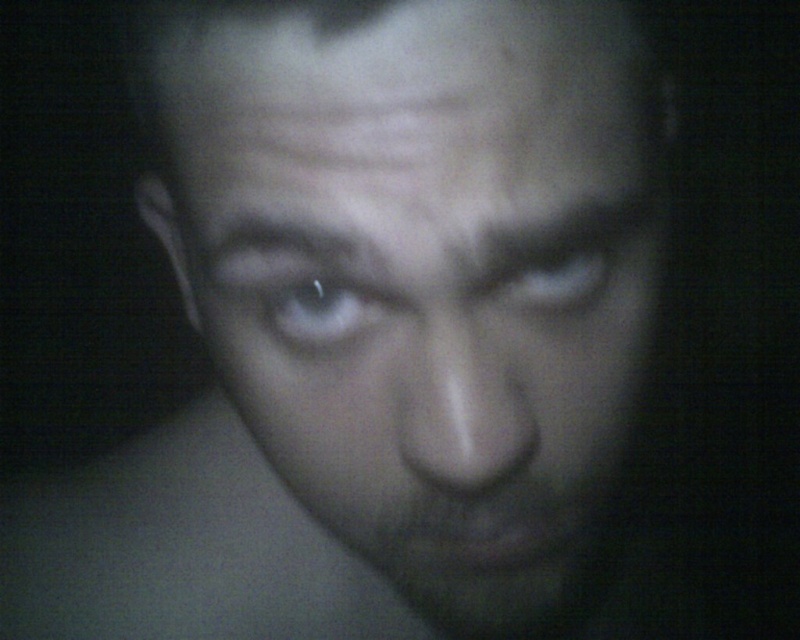
You are a photographer trying to capture a portrait in low light. You notice the smooth skin face at center and the white glossy eye at center in your viewfinder. Which of these two has a greater width in the current framing?

The smooth skin face at center has a greater width than the white glossy eye at center.

You are a photographer adjusting the focus of your camera. You notice a point at the center of the image labeled as point (x=320, y=310). Based on the scene description, what object does this point likely correspond to?

The point (x=320, y=310) corresponds to the white glossy eye at center because the description states that the white glossy eye at center is represented by that point.

You are a photographer trying to adjust the lighting for a portrait. You notice the smooth skin face at center and the white glossy eye at center in your viewfinder. Which object should you focus on to ensure proper exposure, considering their size difference?

The smooth skin face at center has a larger size compared to the white glossy eye at center, so you should focus on the smooth skin face at center for proper exposure since it occupies more of the frame and its size affects the overall lighting balance.